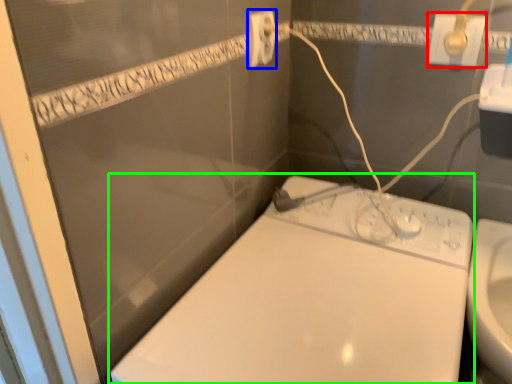
Question: Which is nearer to the power plugs and sockets (highlighted by a red box)? power plugs and sockets (highlighted by a blue box) or toilet (highlighted by a green box).

Choices:
 (A) power plugs and sockets
 (B) toilet

Answer: (A)